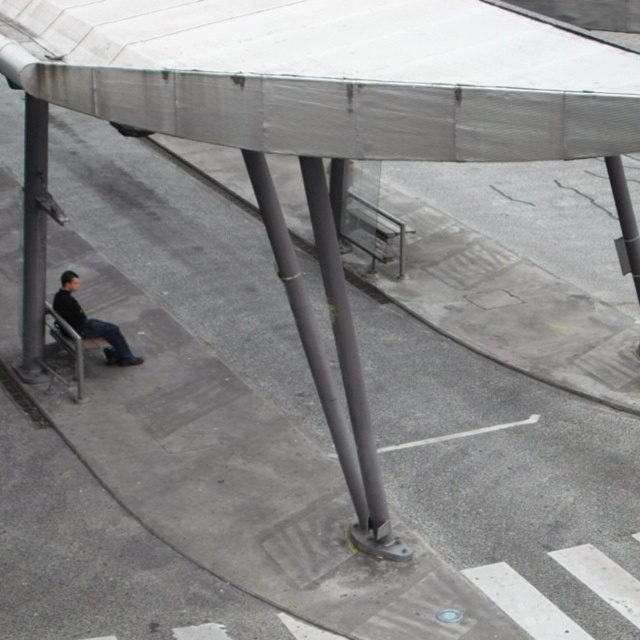
You are standing in the urban scene and want to take a photo of the smooth gray pole at center and the dark gray leather jacket at lower left. Which object should you focus on first if you want to capture both in a single frame without moving the camera?

You should focus on the smooth gray pole at center first because it is closer to the viewer than the dark gray leather jacket at lower left, ensuring both are in focus when using depth of field techniques.